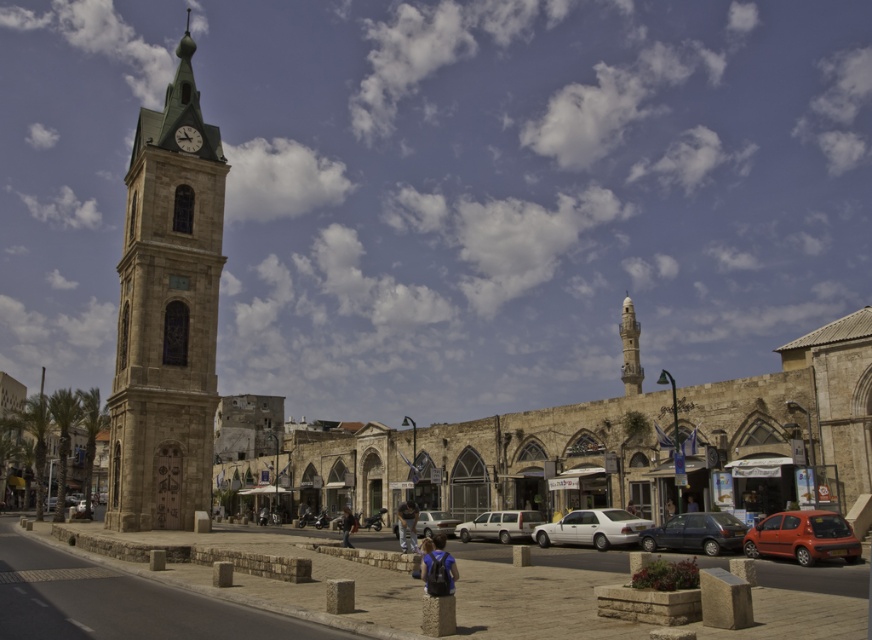
You are a pedestrian standing at the base of the historic clock tower on the left. You need to cross the street to reach a store located near the dark blue jeans at lower center. Is the silver metallic sedan at center blocking your path? Please explain.

The silver metallic sedan at center is closer to the viewer than the dark blue jeans at lower center, so the sedan is between you and the jeans. This means the silver metallic sedan at center is blocking your path to the dark blue jeans at lower center.

You are standing at the center of the image and see the denim pants at center and the matte black car at lower right. Which object is positioned to the right side?

The matte black car at lower right is positioned to the right of the denim pants at center.